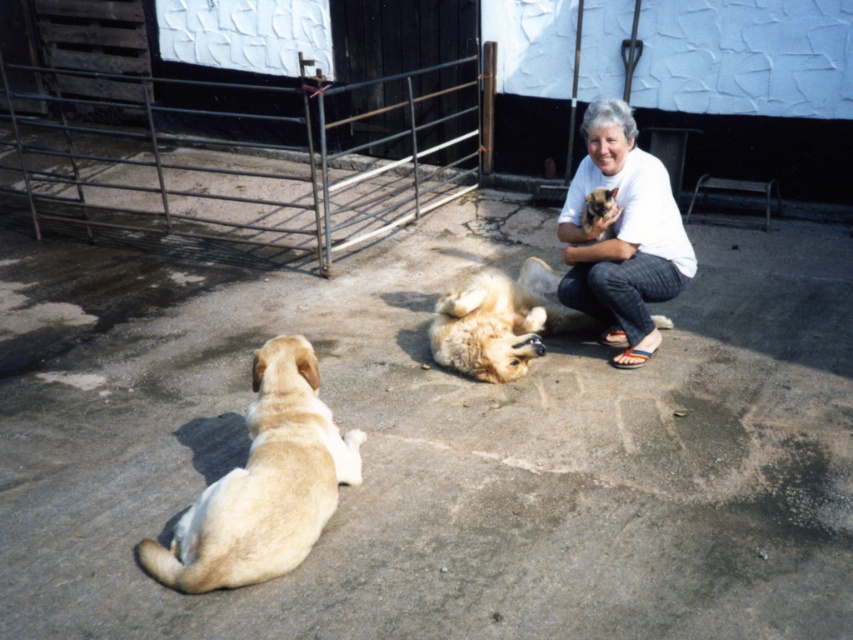
Question: Which object appears closest to the camera in this image?

Choices:
 (A) golden fur dog at center
 (B) white cotton shirt at upper right

Answer: (B)

Question: Observing the image, what is the correct spatial positioning of light brown fur at lower left in reference to white cotton shirt at upper right?

Choices:
 (A) above
 (B) below

Answer: (B)

Question: Among these points, which one is nearest to the camera?

Choices:
 (A) (606, 182)
 (B) (527, 346)

Answer: (B)

Question: Is white cotton shirt at upper right thinner than golden fur dog at center?

Choices:
 (A) no
 (B) yes

Answer: (B)

Question: Among these objects, which one is nearest to the camera?

Choices:
 (A) light brown fur at lower left
 (B) golden fur dog at center

Answer: (A)

Question: Is white cotton shirt at upper right bigger than golden fur dog at center?

Choices:
 (A) yes
 (B) no

Answer: (A)